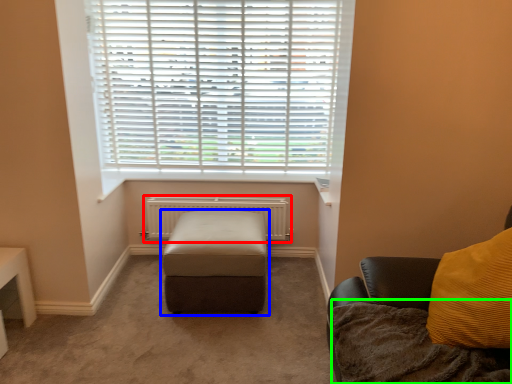
Question: Considering the real-world distances, which object is closest to radiator (highlighted by a red box)? furniture (highlighted by a blue box) or blanket (highlighted by a green box).

Choices:
 (A) furniture
 (B) blanket

Answer: (A)